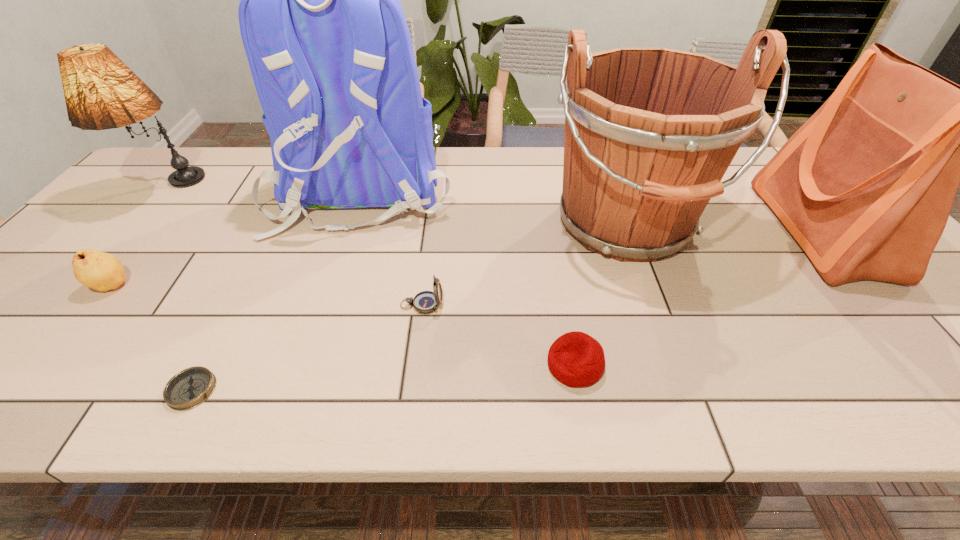
The image size is (960, 540). What are the coordinates of `object located at the right edge` in the screenshot? It's located at (865, 186).

Locate an element on the screen. The height and width of the screenshot is (540, 960). object positioned at the far left corner is located at coordinates (101, 92).

At what (x,y) coordinates should I click in order to perform the action: click on object at the far right corner. Please return your answer as a coordinate pair (x, y). The image size is (960, 540). Looking at the image, I should click on (865, 186).

At what (x,y) coordinates should I click in order to perform the action: click on vacant space at the far edge of the desktop. Please return your answer as a coordinate pair (x, y). The image size is (960, 540). Looking at the image, I should click on (734, 184).

The height and width of the screenshot is (540, 960). In order to click on vacant position at the near edge of the desktop in this screenshot , I will do `click(137, 401)`.

Find the location of `empty location between the bucket and the farther compass`. empty location between the bucket and the farther compass is located at coordinates (523, 265).

Locate an element on the screen. The height and width of the screenshot is (540, 960). free space between the fifth tallest object and the tallest object is located at coordinates (237, 238).

Locate an element on the screen. This screenshot has height=540, width=960. vacant space that's between the shopping bag and the pear is located at coordinates (467, 258).

I want to click on free area in between the backpack and the lampshade, so click(x=266, y=191).

The image size is (960, 540). I want to click on vacant area between the farther compass and the second shortest object, so click(x=498, y=335).